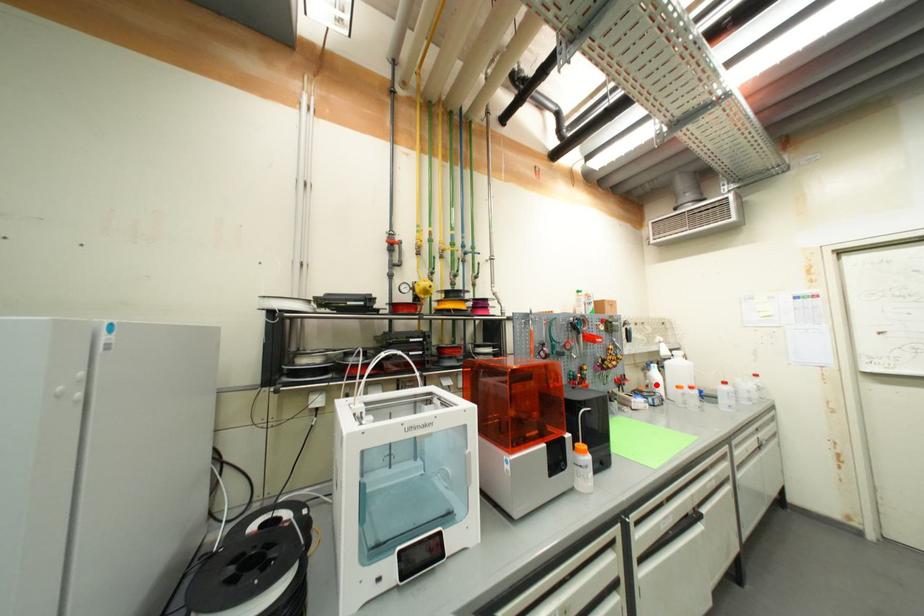
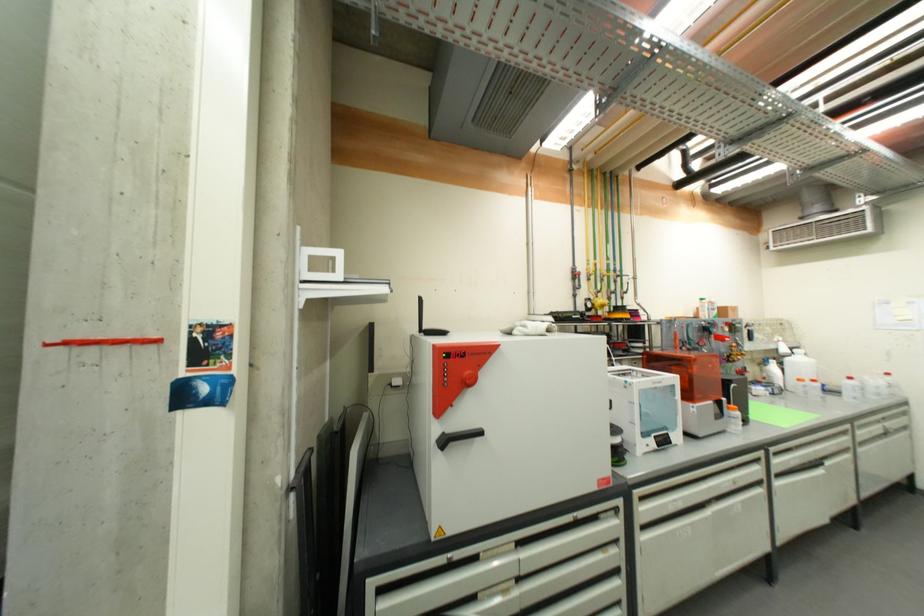
Question: I am providing you with two images of the same scene from different viewpoints. A red point is marked on the first image. At the location where the point appears in image 1, is it still visible in image 2?

Choices:
 (A) Yes
 (B) No

Answer: (A)